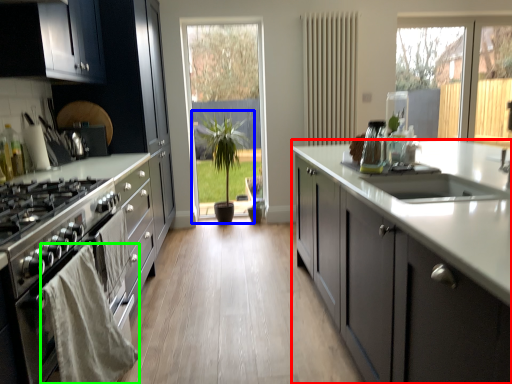
Question: Which is nearer to the cabinetry (highlighted by a red box)? houseplant (highlighted by a blue box) or material (highlighted by a green box).

Choices:
 (A) houseplant
 (B) material

Answer: (B)